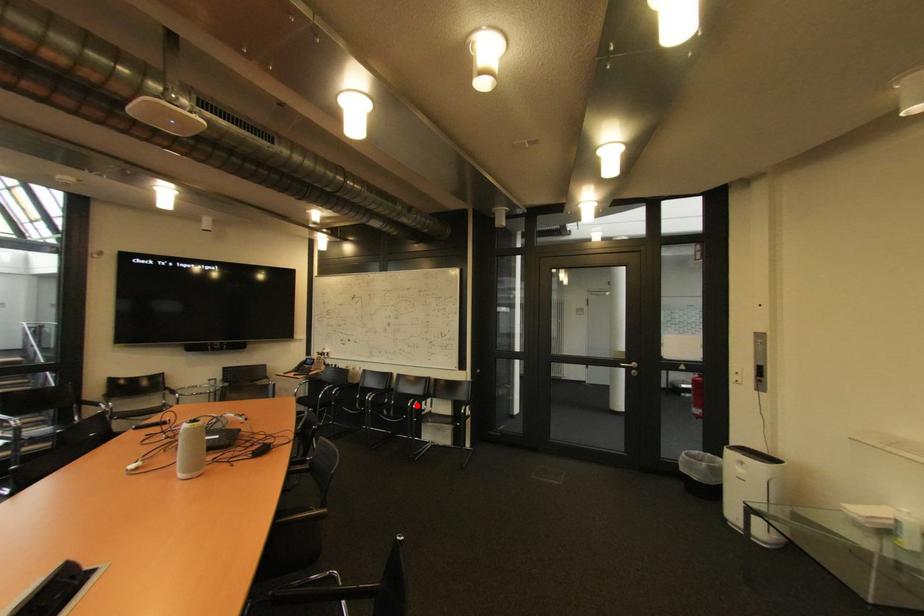
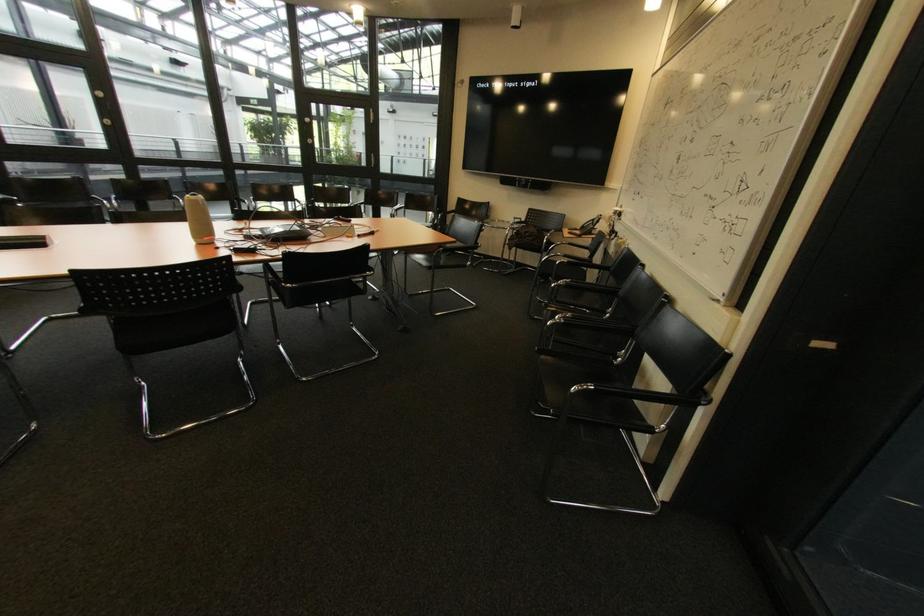
Find the pixel in the second image that matches the highlighted location in the first image.

(565, 318)